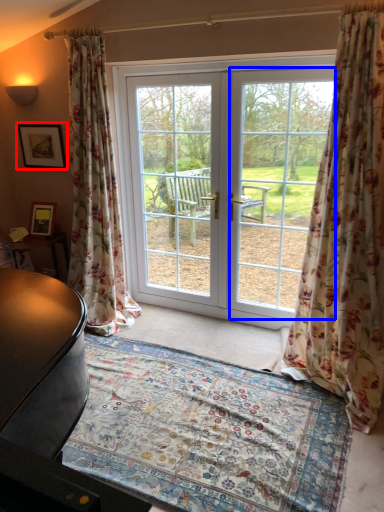
Question: Which object is closer to the camera taking this photo, picture frame (highlighted by a red box) or window screen (highlighted by a blue box)?

Choices:
 (A) picture frame
 (B) window screen

Answer: (B)